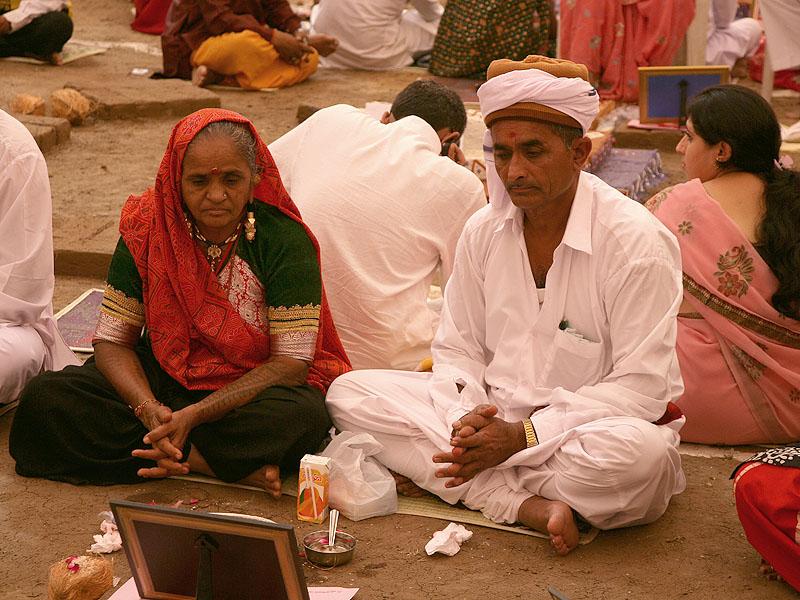
What are the coordinates of `utensil handle used to grip the utensil` in the screenshot? It's located at (333, 526).